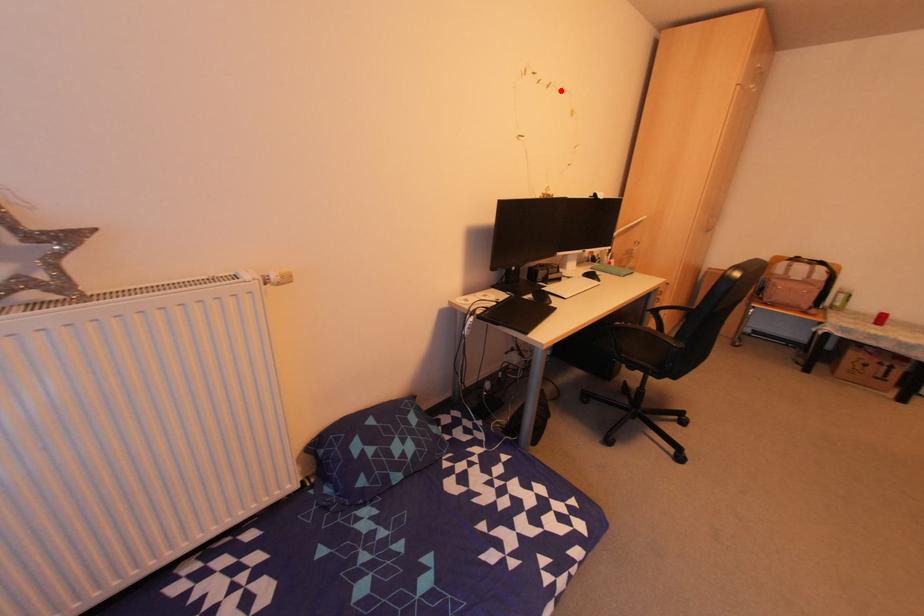
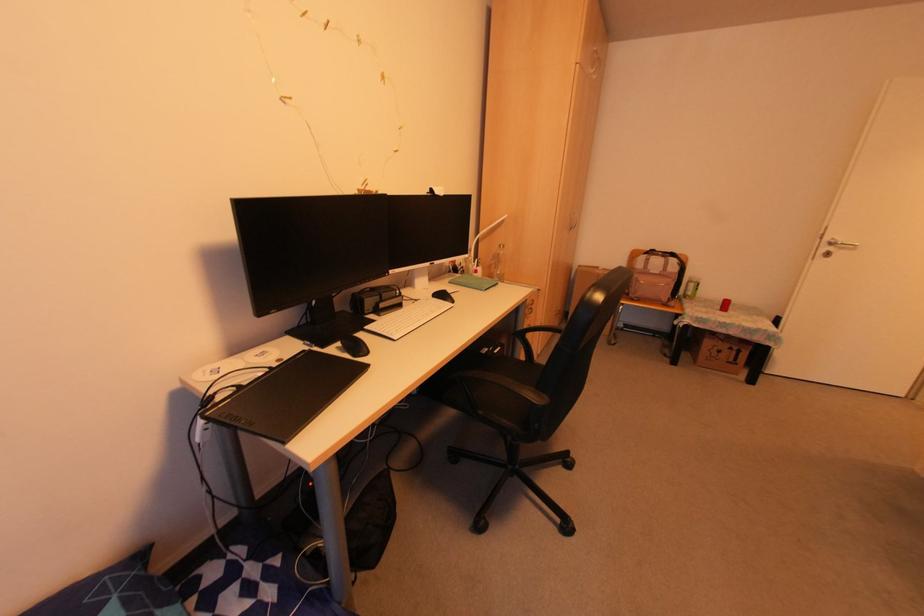
The point at the highlighted location is marked in the first image. Where is the corresponding point in the second image?

(358, 41)